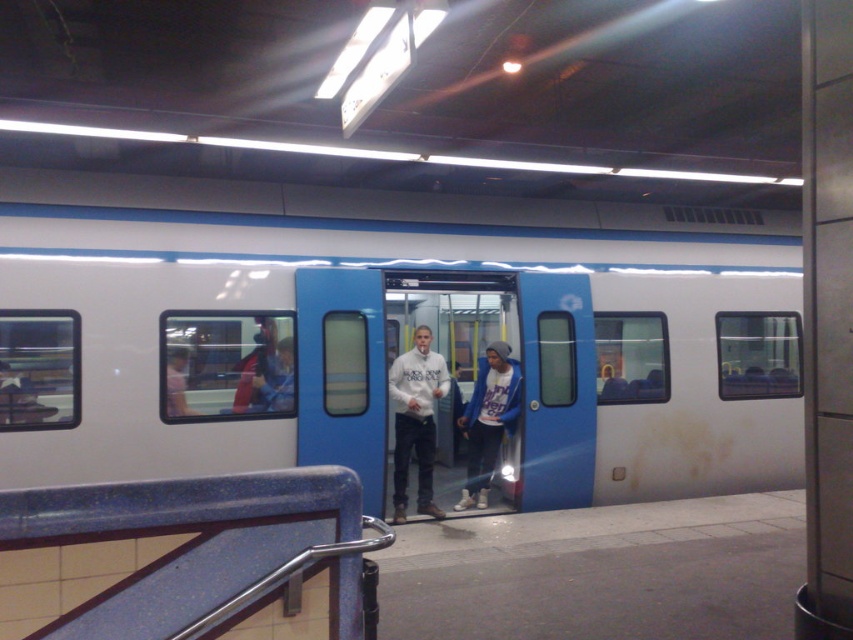
Question: Which of the following is the farthest from the observer?

Choices:
 (A) white matte hoodie at center
 (B) white cotton hoodie at center

Answer: (B)

Question: Can you confirm if white matte train at center is bigger than white matte hoodie at center?

Choices:
 (A) no
 (B) yes

Answer: (B)

Question: Is white matte train at center below white matte hoodie at center?

Choices:
 (A) no
 (B) yes

Answer: (A)

Question: Does white matte train at center have a smaller size compared to white cotton hoodie at center?

Choices:
 (A) no
 (B) yes

Answer: (A)

Question: Which of the following is the closest to the observer?

Choices:
 (A) white matte train at center
 (B) white matte hoodie at center
 (C) white cotton hoodie at center

Answer: (A)

Question: Which of the following is the closest to the observer?

Choices:
 (A) white cotton hoodie at center
 (B) white matte hoodie at center

Answer: (B)